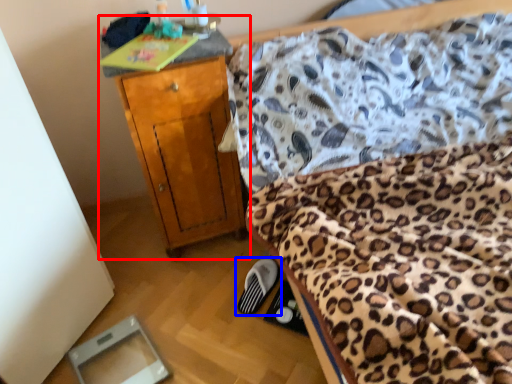
Question: Among these objects, which one is farthest to the camera, nightstand (highlighted by a red box) or footwear (highlighted by a blue box)?

Choices:
 (A) nightstand
 (B) footwear

Answer: (B)